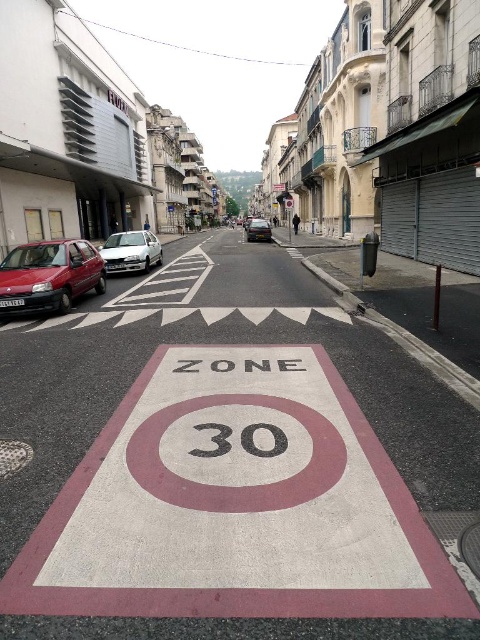
The height and width of the screenshot is (640, 480). I want to click on white concrete bike lane at center, so click(x=217, y=477).

Does point (160, 460) lie in front of point (226, 449)?

Yes, it is in front of point (226, 449).

Describe the element at coordinates (217, 477) in the screenshot. The width and height of the screenshot is (480, 640). I see `white concrete bike lane at center` at that location.

Where is `white concrete bike lane at center`? white concrete bike lane at center is located at coordinates (217, 477).

Is matte red car at left further to the viewer compared to white metallic car at left?

No.

Is matte red car at left closer to camera compared to white metallic car at left?

Yes, it is in front of white metallic car at left.

Where is `matte red car at left`? The height and width of the screenshot is (640, 480). matte red car at left is located at coordinates (48, 275).

Who is positioned more to the left, matte red car at left or shiny black car at center?

matte red car at left

Does matte red car at left appear on the left side of shiny black car at center?

Yes, matte red car at left is to the left of shiny black car at center.

Is point (48, 244) positioned behind point (252, 234)?

No, (48, 244) is in front of (252, 234).

Identify the location of matte red car at left. The width and height of the screenshot is (480, 640). (48, 275).